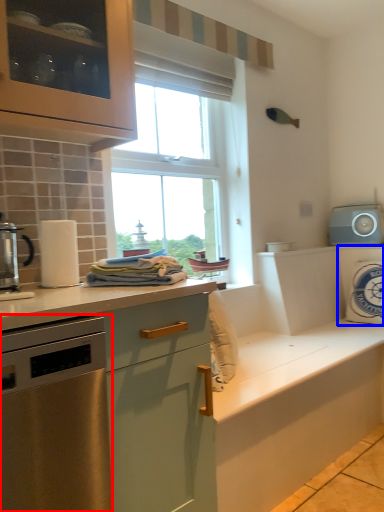
Question: Which object is further to the camera taking this photo, home appliance (highlighted by a red box) or appliance (highlighted by a blue box)?

Choices:
 (A) home appliance
 (B) appliance

Answer: (B)